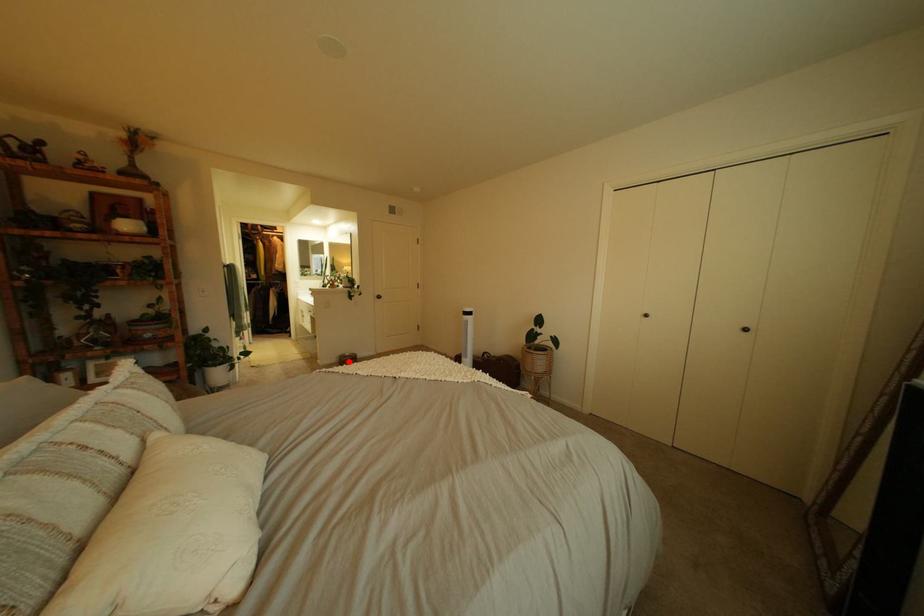
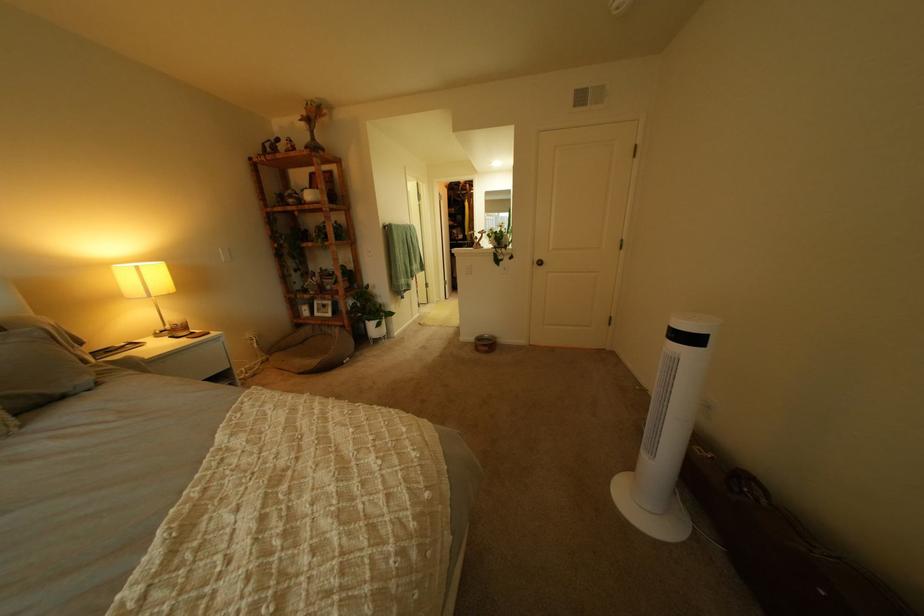
The point at the highlighted location is marked in the first image. Where is the corresponding point in the second image?

(489, 339)